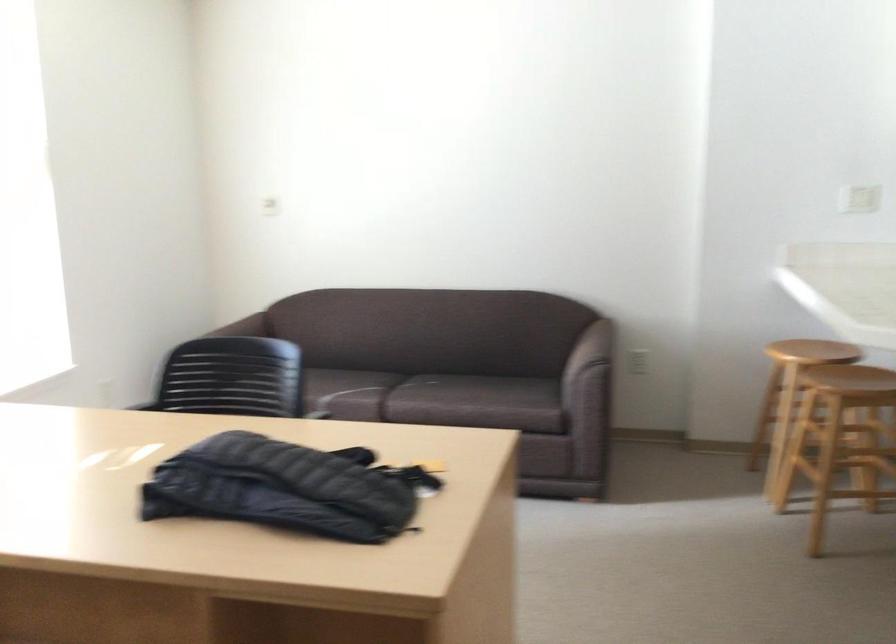
Where would you lean the black chair backrest? Please return your answer as a coordinate pair (x, y).

(217, 366)